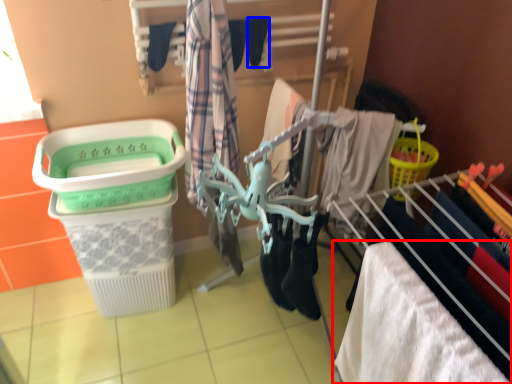
Question: Which point is closer to the camera, towel (highlighted by a red box) or shoe (highlighted by a blue box)?

Choices:
 (A) towel
 (B) shoe

Answer: (A)